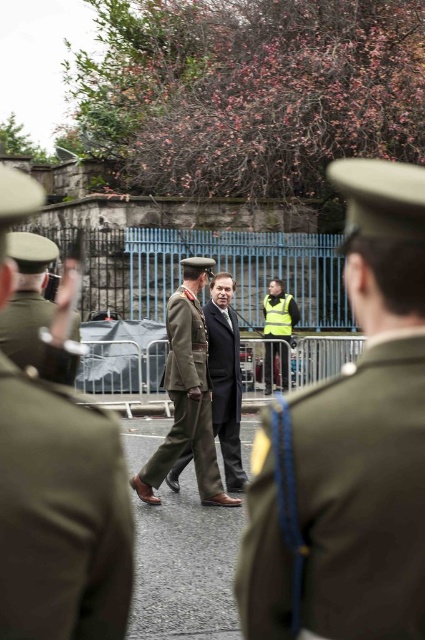
You are a photographer setting up for a formal event. You need to place a small tripod between the dark brown leather shoes at center and the yellow reflective vest at center so that it doesn t block either object. Given their widths, can the tripod be placed between them without overlapping?

The dark brown leather shoes at center have a smaller width than the yellow reflective vest at center. Since the shoes are narrower, there is sufficient space between them to place the tripod without overlapping either object.

You are a photographer at a military event. You need to capture a photo where the camouflage fabric uniform at center is visible above the yellow reflective vest at center. Is this possible based on their current positions?

The camouflage fabric uniform at center is positioned under the yellow reflective vest at center, so it cannot be seen above it in the current arrangement.